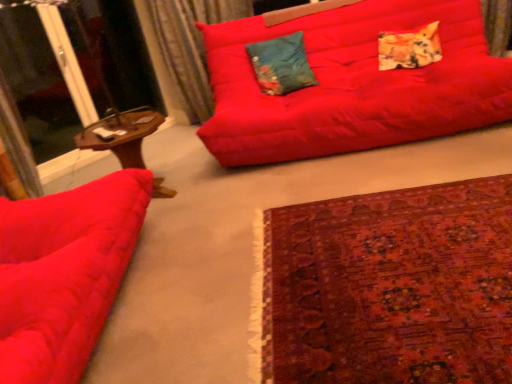
Find the location of `vacant space that's between matte red studio couch at upper center, marked as the 2th studio couch in a left-to-right arrangement, and carpet with intricate patterns at lower right`. vacant space that's between matte red studio couch at upper center, marked as the 2th studio couch in a left-to-right arrangement, and carpet with intricate patterns at lower right is located at coordinates (323, 188).